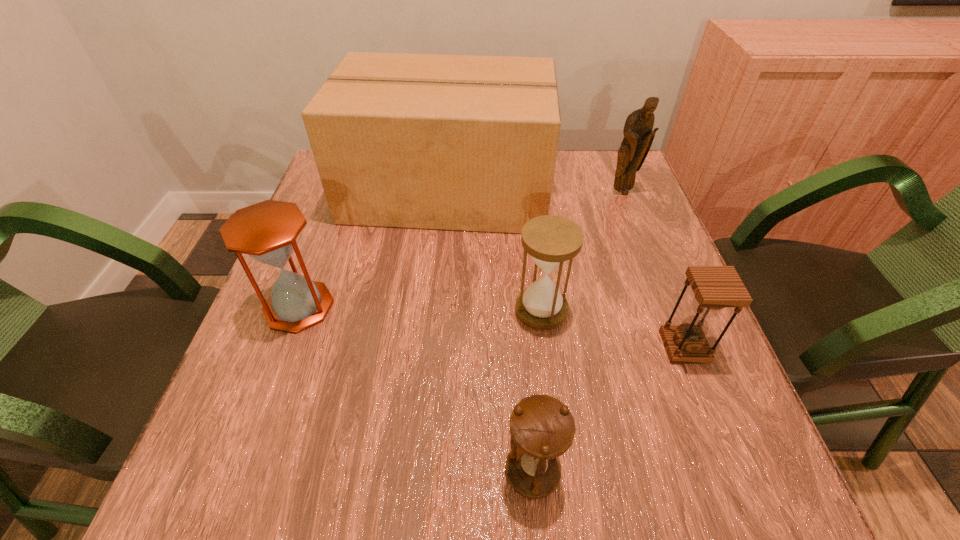
Find the location of a particular element. free location that satisfies the following two spatial constraints: 1. on the front-facing side of the figurine; 2. on the right side of the rightmost hourglass is located at coordinates tap(682, 347).